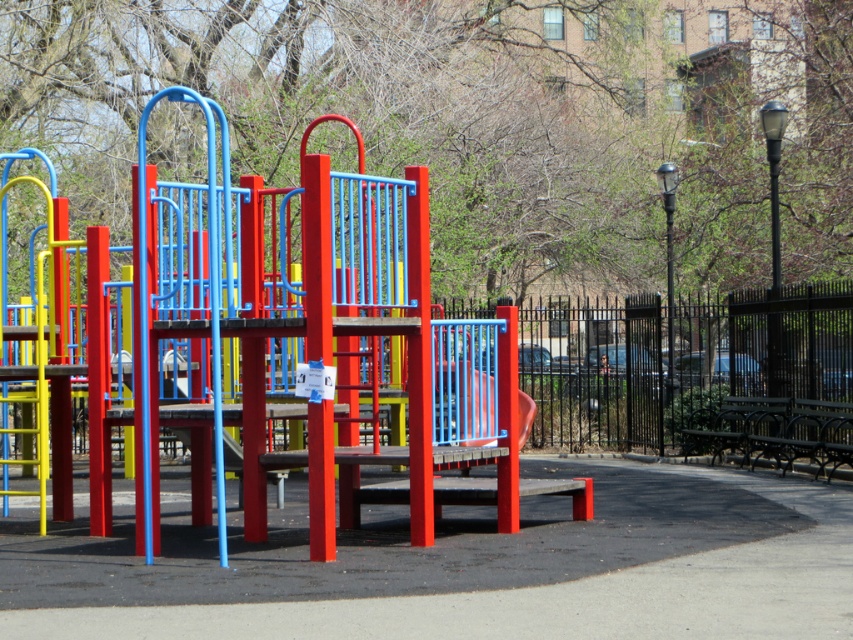
Question: Can you confirm if black polished wood bench at lower right is wider than smooth plastic slide at center?

Choices:
 (A) yes
 (B) no

Answer: (A)

Question: Considering the real-world distances, which object is farthest from the black metal bench at right?

Choices:
 (A) black polished wood bench at lower right
 (B) smooth plastic slide at center

Answer: (B)

Question: Among these objects, which one is nearest to the camera?

Choices:
 (A) black polished wood bench at lower right
 (B) black metal bench at right

Answer: (A)

Question: Does black polished wood bench at lower right appear on the right side of black metal bench at right?

Choices:
 (A) no
 (B) yes

Answer: (B)

Question: Observing the image, what is the correct spatial positioning of black metal bench at right in reference to smooth plastic slide at center?

Choices:
 (A) left
 (B) right

Answer: (B)

Question: Which point is farther to the camera?

Choices:
 (A) (524, 413)
 (B) (758, 426)

Answer: (B)